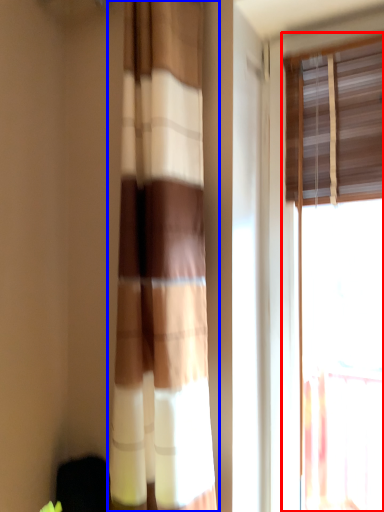
Question: Among these objects, which one is farthest to the camera, window (highlighted by a red box) or curtain (highlighted by a blue box)?

Choices:
 (A) window
 (B) curtain

Answer: (A)